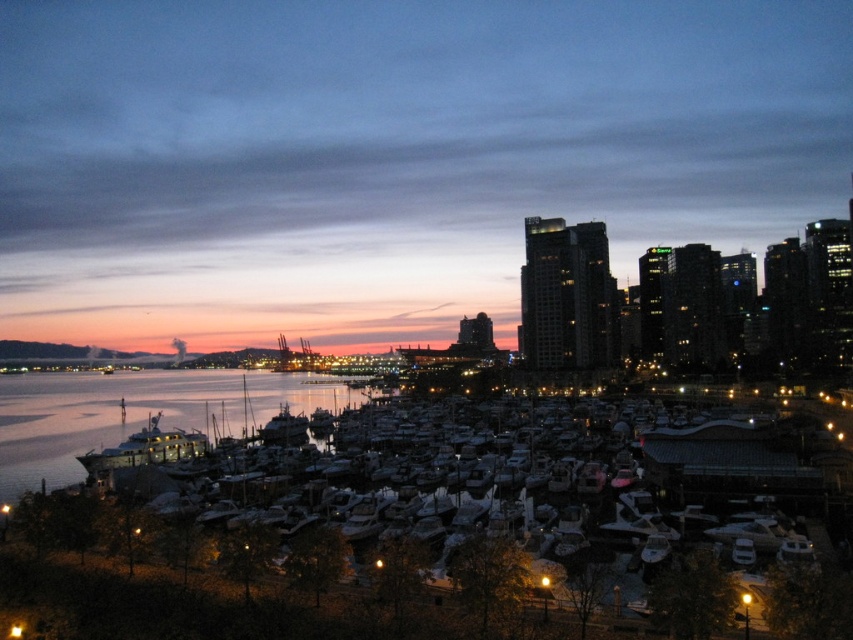
Question: Does glossy water at center have a lesser width compared to shiny silver yacht at center?

Choices:
 (A) yes
 (B) no

Answer: (B)

Question: Is glossy water at center wider than shiny metallic boat at center?

Choices:
 (A) no
 (B) yes

Answer: (B)

Question: Which object is closer to the camera taking this photo?

Choices:
 (A) glossy water at center
 (B) shiny metallic boat at center
 (C) shiny silver yacht at center

Answer: (A)

Question: Can you confirm if glossy water at center is positioned above shiny silver yacht at center?

Choices:
 (A) no
 (B) yes

Answer: (A)

Question: Estimate the real-world distances between objects in this image. Which object is closer to the shiny silver yacht at center?

Choices:
 (A) glossy water at center
 (B) shiny metallic boat at center

Answer: (B)

Question: Which point is farther to the camera?

Choices:
 (A) (262, 438)
 (B) (10, 451)
 (C) (164, 435)

Answer: (A)